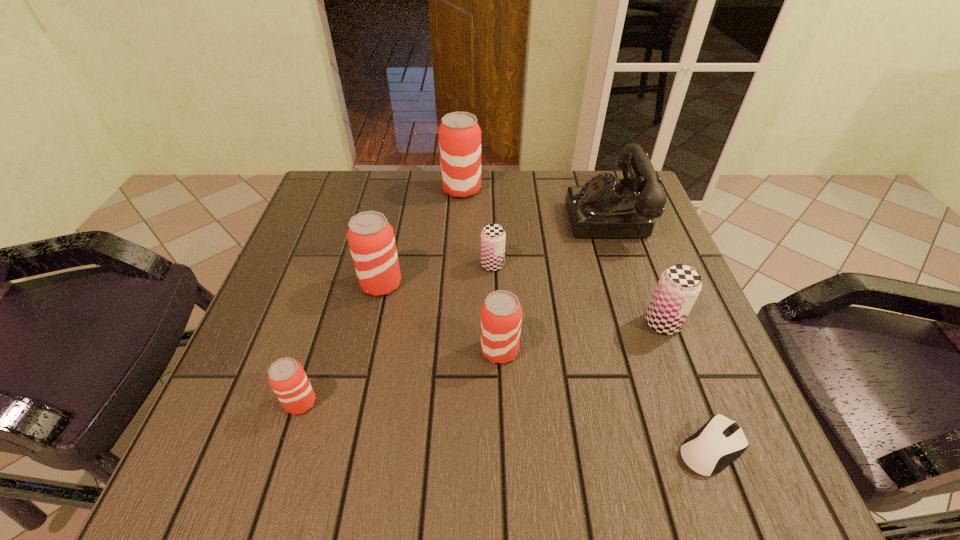
Find the location of a particular element. the tallest object is located at coordinates (459, 133).

The image size is (960, 540). Find the location of `the farthest orange beer can`. the farthest orange beer can is located at coordinates (459, 133).

I want to click on telephone, so click(x=604, y=207).

Find the location of a particular element. Image resolution: width=960 pixels, height=540 pixels. the second farthest orange beer can is located at coordinates (370, 236).

This screenshot has width=960, height=540. What are the coordinates of `the second orange beer can from left to right` in the screenshot? It's located at (370, 236).

At what (x,y) coordinates should I click in order to perform the action: click on the third biggest orange beer can. Please return your answer as a coordinate pair (x, y). This screenshot has height=540, width=960. Looking at the image, I should click on (501, 314).

Locate an element on the screen. Image resolution: width=960 pixels, height=540 pixels. the rightmost beer can is located at coordinates (679, 286).

Locate an element on the screen. the right purple beer can is located at coordinates (679, 286).

Image resolution: width=960 pixels, height=540 pixels. In order to click on the smaller purple beer can in this screenshot , I will do `click(493, 237)`.

Where is `the left purple beer can`? The width and height of the screenshot is (960, 540). the left purple beer can is located at coordinates (493, 237).